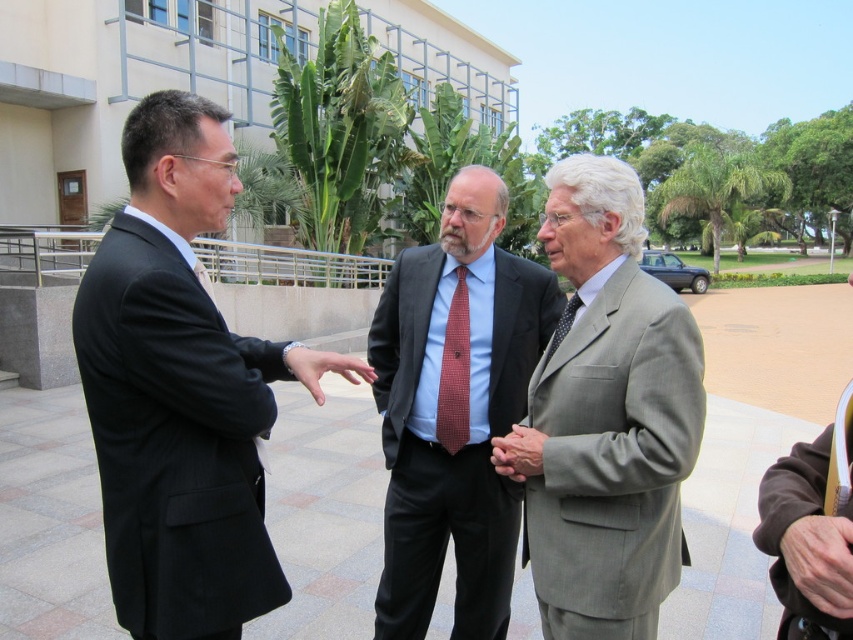
You are standing in front of the building and want to walk to the point that is closer to you. Which point should you head towards, point [366,372] or point [556,324]?

You should head towards point [366,372] because it is closer to the viewer than point [556,324].

You are standing at the camera position and want to reach the point at coordinates point (x=409, y=262). Can you estimate how far you need to walk to reach that point?

The distance of point (x=409, y=262) from camera is 9.13 feet, so you need to walk approximately 9.13 feet to reach that point.